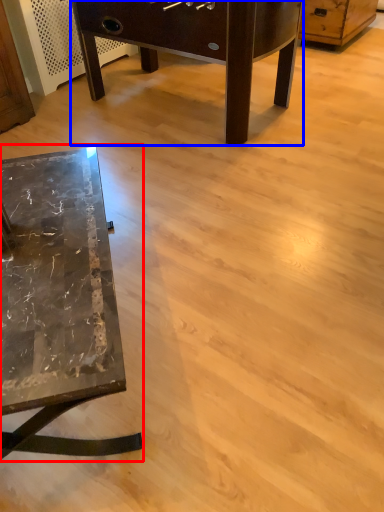
Question: Which point is closer to the camera, table (highlighted by a red box) or table (highlighted by a blue box)?

Choices:
 (A) table
 (B) table

Answer: (A)